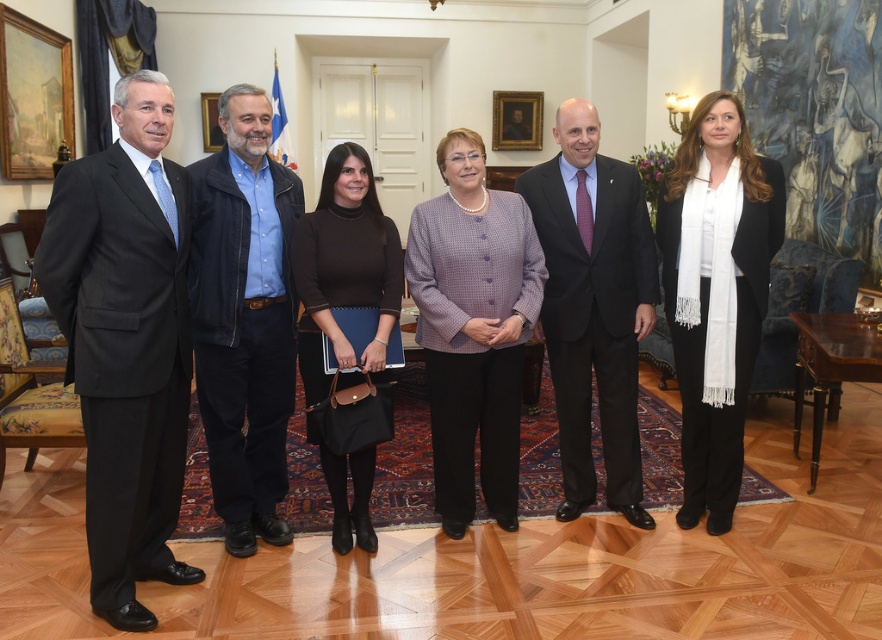
Between blue denim shirt at center and white wool scarf at right, which one has less height?

Standing shorter between the two is white wool scarf at right.

At what (x,y) coordinates should I click in order to perform the action: click on blue denim shirt at center. Please return your answer as a coordinate pair (x, y). Image resolution: width=882 pixels, height=640 pixels. Looking at the image, I should click on (244, 317).

Is white wool scarf at right bigger than black matte sweater at center?

Actually, white wool scarf at right might be smaller than black matte sweater at center.

Is white wool scarf at right above black matte sweater at center?

Yes, white wool scarf at right is above black matte sweater at center.

Who is more distant from viewer, (723, 141) or (335, 467)?

Positioned behind is point (335, 467).

Image resolution: width=882 pixels, height=640 pixels. Identify the location of white wool scarf at right. (716, 292).

Who is taller, blue denim shirt at center or black matte sweater at center?

blue denim shirt at center is taller.

Is blue denim shirt at center in front of black matte sweater at center?

Yes, it is in front of black matte sweater at center.

The image size is (882, 640). I want to click on blue denim shirt at center, so click(x=244, y=317).

Where is `blue denim shirt at center`? The width and height of the screenshot is (882, 640). blue denim shirt at center is located at coordinates (244, 317).